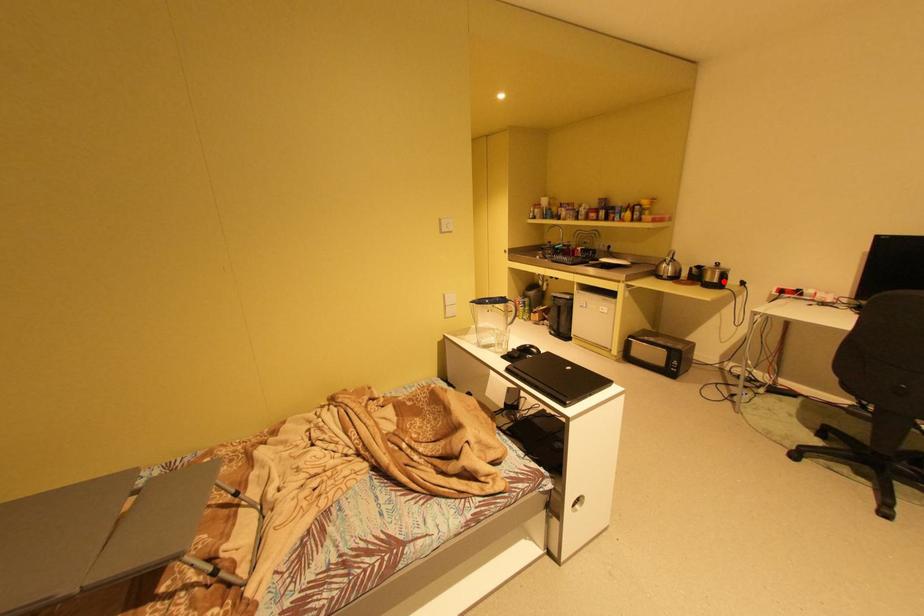
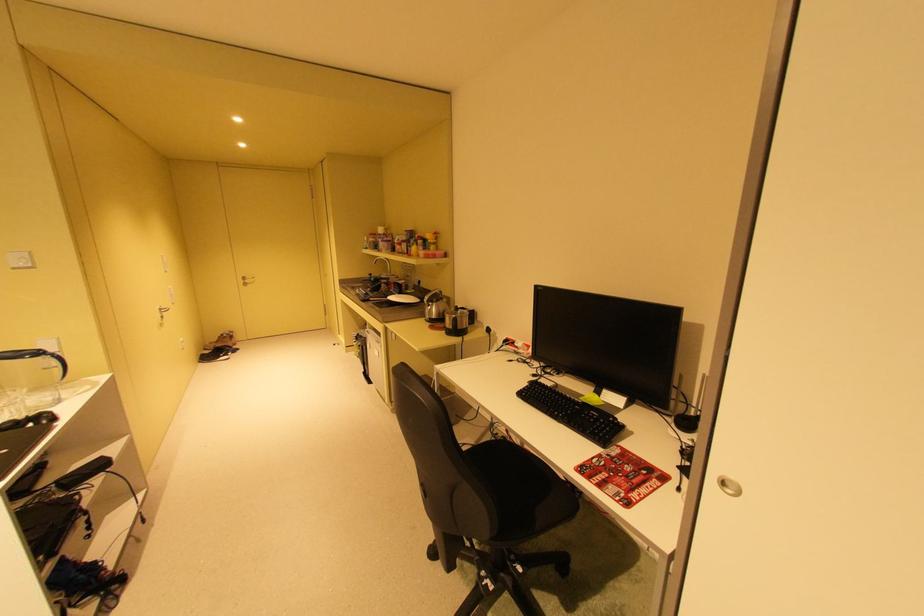
Locate, in the second image, the point that corresponds to the highlighted location in the first image.

(460, 328)